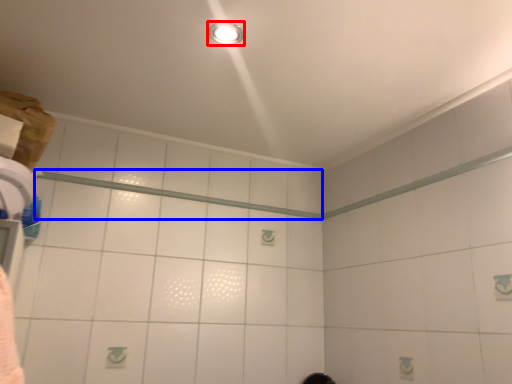
Question: Which point is closer to the camera, light fixture (highlighted by a red box) or beam (highlighted by a blue box)?

Choices:
 (A) light fixture
 (B) beam

Answer: (A)